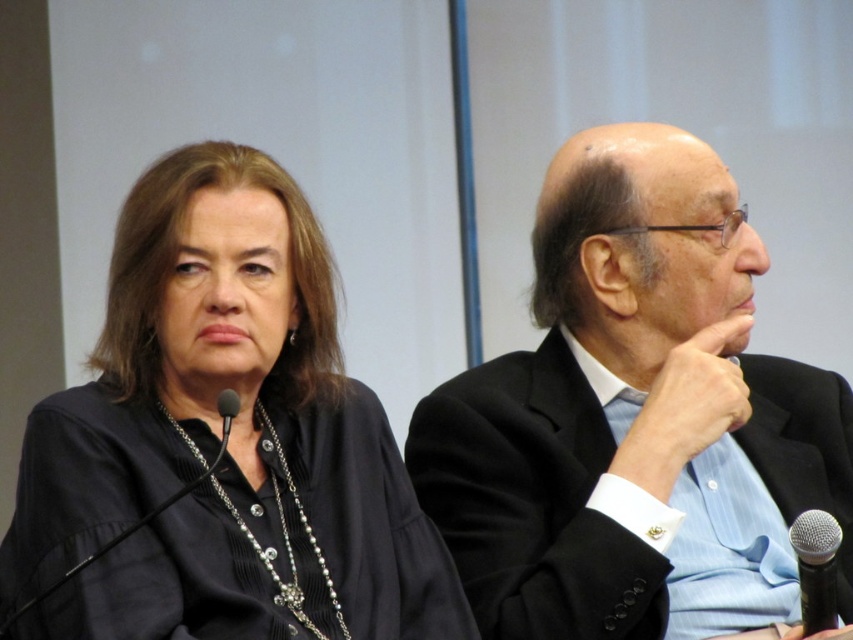
Which of these two, silver metallic microphone at lower right or black matte microphone at lower left, stands taller?

silver metallic microphone at lower right is taller.

Is point (808, 552) less distant than point (236, 406)?

That is False.

The height and width of the screenshot is (640, 853). Describe the element at coordinates (816, 566) in the screenshot. I see `silver metallic microphone at lower right` at that location.

Find the location of a particular element. silver metallic microphone at lower right is located at coordinates (816, 566).

Does black suit at right have a greater height compared to silver metallic microphone at lower right?

Yes, black suit at right is taller than silver metallic microphone at lower right.

Image resolution: width=853 pixels, height=640 pixels. In order to click on black suit at right in this screenshot , I will do `click(634, 417)`.

Does black suit at right come behind black matte shirt at left?

Yes, it is behind black matte shirt at left.

Is black suit at right bigger than black matte shirt at left?

Correct, black suit at right is larger in size than black matte shirt at left.

Identify the location of black suit at right. The width and height of the screenshot is (853, 640). (634, 417).